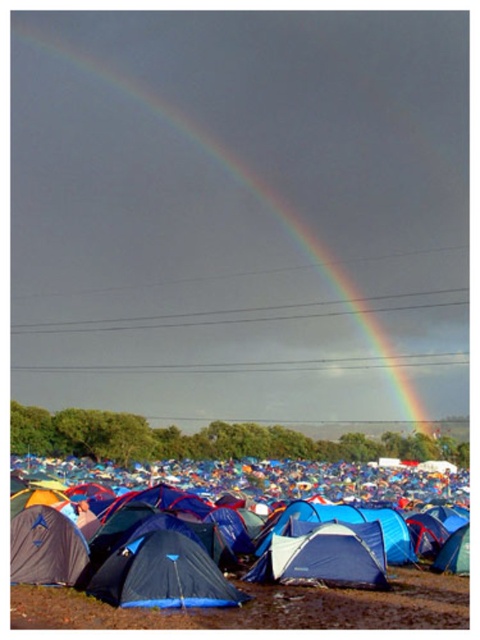
Question: Does rainbow at upper center appear under blue fabric tent at lower center?

Choices:
 (A) no
 (B) yes

Answer: (A)

Question: Based on their relative distances, which object is farther from the rainbow at upper center?

Choices:
 (A) blue fabric tent at center
 (B) blue fabric tent at lower center

Answer: (A)

Question: Which point appears farthest from the camera in this image?

Choices:
 (A) (168, 596)
 (B) (370, 116)
 (C) (374, 467)

Answer: (B)

Question: Which point is farther to the camera?

Choices:
 (A) (100, 225)
 (B) (243, 600)
 (C) (278, 493)

Answer: (A)

Question: Can you confirm if rainbow at upper center is positioned to the right of blue fabric tent at center?

Choices:
 (A) yes
 (B) no

Answer: (B)

Question: Where is rainbow at upper center located in relation to blue fabric tent at center in the image?

Choices:
 (A) above
 (B) below

Answer: (A)